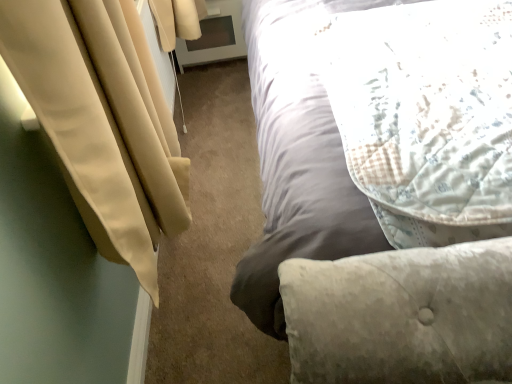
Question: Could fluffy white pillow at upper right be considered to be inside light gray fabric bed at upper right?

Choices:
 (A) no
 (B) yes

Answer: (B)

Question: Is light gray fabric bed at upper right bigger than fluffy white pillow at upper right?

Choices:
 (A) yes
 (B) no

Answer: (A)

Question: Does light gray fabric bed at upper right have a greater width compared to fluffy white pillow at upper right?

Choices:
 (A) no
 (B) yes

Answer: (B)

Question: From the image's perspective, is light gray fabric bed at upper right over fluffy white pillow at upper right?

Choices:
 (A) no
 (B) yes

Answer: (B)

Question: Is light gray fabric bed at upper right oriented away from fluffy white pillow at upper right?

Choices:
 (A) no
 (B) yes

Answer: (A)

Question: Is light gray fabric bed at upper right closer to camera compared to fluffy white pillow at upper right?

Choices:
 (A) no
 (B) yes

Answer: (B)

Question: Can you confirm if fluffy white pillow at upper right is taller than beige fabric curtain at left?

Choices:
 (A) no
 (B) yes

Answer: (A)

Question: Considering the relative sizes of fluffy white pillow at upper right and beige fabric curtain at left in the image provided, is fluffy white pillow at upper right shorter than beige fabric curtain at left?

Choices:
 (A) no
 (B) yes

Answer: (B)

Question: Considering the relative positions of fluffy white pillow at upper right and beige fabric curtain at left in the image provided, is fluffy white pillow at upper right to the left of beige fabric curtain at left from the viewer's perspective?

Choices:
 (A) yes
 (B) no

Answer: (B)

Question: Is beige fabric curtain at left a part of fluffy white pillow at upper right?

Choices:
 (A) yes
 (B) no

Answer: (B)

Question: From a real-world perspective, does fluffy white pillow at upper right stand above beige fabric curtain at left?

Choices:
 (A) no
 (B) yes

Answer: (A)

Question: Could you tell me if fluffy white pillow at upper right is turned towards beige fabric curtain at left?

Choices:
 (A) yes
 (B) no

Answer: (B)

Question: Can you confirm if light gray fabric bed at upper right is shorter than beige fabric curtain at left?

Choices:
 (A) no
 (B) yes

Answer: (A)